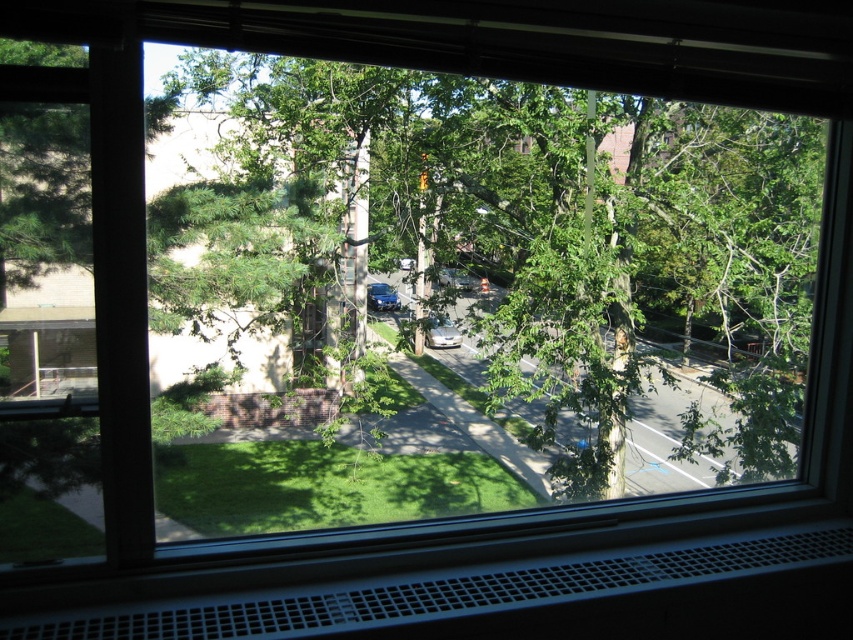
Who is more distant from viewer, (456, 339) or (405, 259)?

The point (456, 339) is more distant.

Which of these two, silver metallic car at center or shiny blue sedan at center, stands shorter?

shiny blue sedan at center is shorter.

Who is more distant from viewer, (x=434, y=317) or (x=410, y=266)?

Positioned behind is point (x=410, y=266).

The image size is (853, 640). In order to click on silver metallic car at center in this screenshot , I will do `click(440, 332)`.

Does metallic silver sedan at center have a lesser width compared to shiny blue sedan at center?

In fact, metallic silver sedan at center might be wider than shiny blue sedan at center.

Is point (453, 275) farther from viewer compared to point (412, 260)?

Yes, it is.

Find the location of a particular element. Image resolution: width=853 pixels, height=640 pixels. metallic silver sedan at center is located at coordinates (454, 280).

Does metallic blue sedan at center have a larger size compared to metallic silver sedan at center?

No, metallic blue sedan at center is not bigger than metallic silver sedan at center.

Does metallic blue sedan at center have a lesser width compared to metallic silver sedan at center?

Yes.

Locate an element on the screen. This screenshot has height=640, width=853. metallic blue sedan at center is located at coordinates (381, 296).